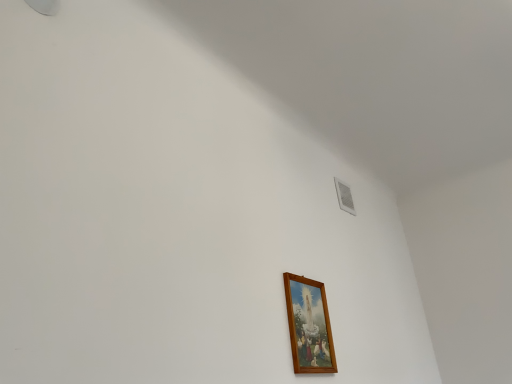
I want to click on wooden picture frame at lower center, so (309, 325).

What do you see at coordinates (309, 325) in the screenshot? I see `wooden picture frame at lower center` at bounding box center [309, 325].

Find the location of `wooden picture frame at lower center`. wooden picture frame at lower center is located at coordinates (309, 325).